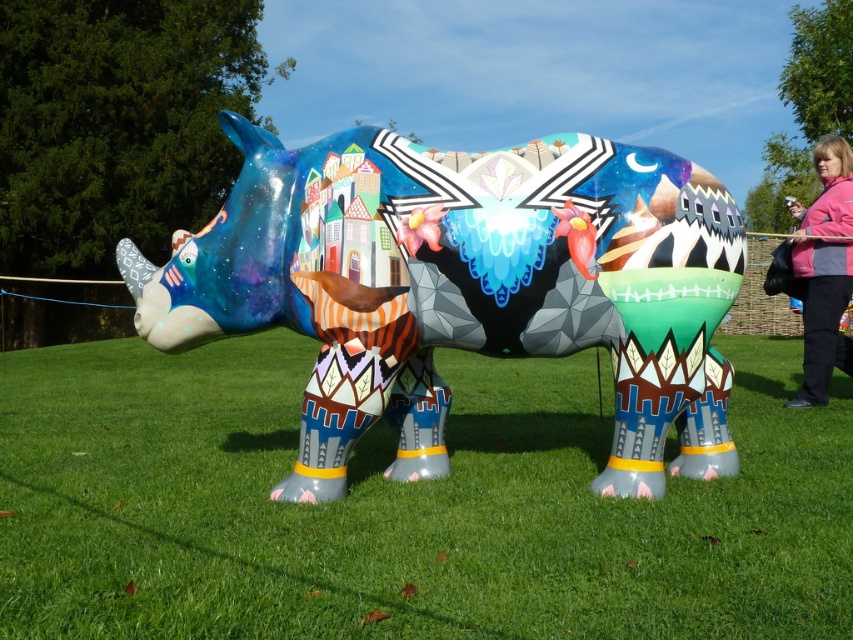
Is green grass at lower center taller than pink fleece jacket at right?

Incorrect, green grass at lower center's height is not larger of pink fleece jacket at right's.

Is point (492, 458) closer to camera compared to point (828, 257)?

That is True.

Is point (677, 481) positioned before point (814, 148)?

Yes, point (677, 481) is in front of point (814, 148).

At what (x,y) coordinates should I click in order to perform the action: click on green grass at lower center. Please return your answer as a coordinate pair (x, y). Looking at the image, I should click on (404, 506).

This screenshot has width=853, height=640. Describe the element at coordinates (404, 506) in the screenshot. I see `green grass at lower center` at that location.

Can you confirm if green grass at lower center is taller than glossy painted rhino at center?

Incorrect, green grass at lower center's height is not larger of glossy painted rhino at center's.

Which is behind, point (55, 364) or point (218, 272)?

The point (55, 364) is more distant.

Locate an element on the screen. This screenshot has height=640, width=853. green grass at lower center is located at coordinates (404, 506).

Based on the photo, which is more to the right, glossy painted rhino at center or pink fleece jacket at right?

pink fleece jacket at right

Measure the distance between glossy painted rhino at center and pink fleece jacket at right.

A distance of 8.84 feet exists between glossy painted rhino at center and pink fleece jacket at right.

Between point (308, 220) and point (848, 275), which one is positioned behind?

The point (848, 275) is more distant.

I want to click on glossy painted rhino at center, so click(x=456, y=282).